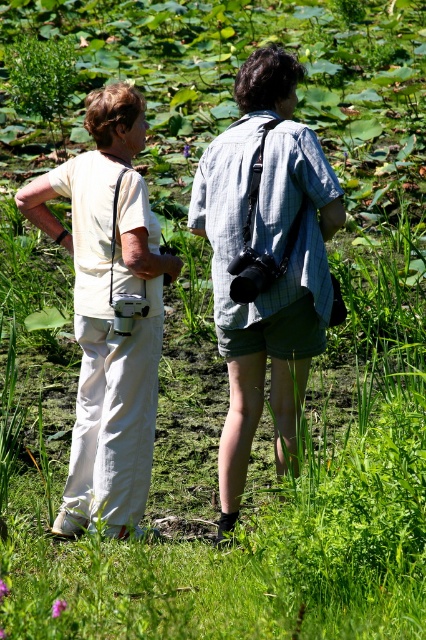
You are standing in a lush green area and see two points marked in the image. Which point is closer to you, point (166, 256) or point (201, 193)?

Point (166, 256) is closer to you because it is further to the viewer than point (201, 193).

You are a photographer trying to capture a closeup shot of the pants at the left side of the image. You have a lens that can focus as close as 6 inches. Do you think you can get a clear photo of the matte white pants at left and white cotton pants at left with this lens?

The matte white pants at left is 6.29 inches away from white cotton pants at left. Since your lens can focus as close as 6 inches, you can get a clear photo as the distance between them is just over the minimum focus distance.

You are a fashion designer analyzing clothing items in a photo. You notice two pairs of pants labeled as white cotton pants at left and matte white pants at left. Which pair has a wider leg opening?

The matte white pants at left are wider than white cotton pants at left, so the matte white pants at left have a wider leg opening.